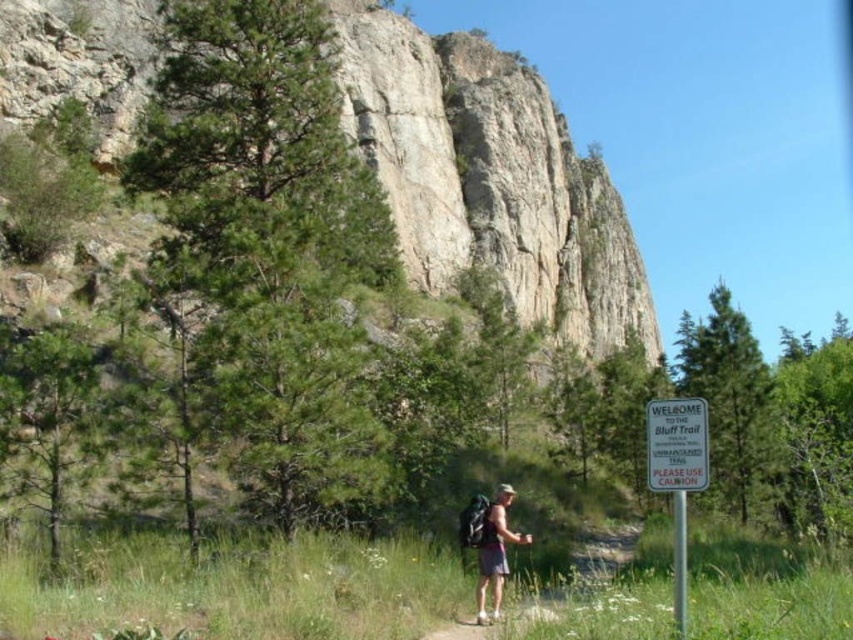
You are a hiker who wants to take a photo of the white plastic sign at center and the matte gray backpack at center. Which object should you zoom in on to capture both in the frame without moving your camera?

The white plastic sign at center occupies less space than the matte gray backpack at center, so you should zoom in on the matte gray backpack at center to include both objects in the frame without moving the camera.

You are a hiker who wants to take a photo of the rugged stone mountain at center and the matte gray backpack at center. Which object should you focus on first to ensure both are in the frame?

The rugged stone mountain at center is located above the matte gray backpack at center, so you should focus on the rugged stone mountain at center first to ensure both are in the frame.

You are a hiker standing at the point marked by the coordinates (x=490, y=179) on the map. Looking around, you see a rugged stone mountain at center. Which direction should you head to reach the signpost that says WELCOME TO THE Bluff Trail?

The point marked by the coordinates (x=490, y=179) is at the rugged stone mountain at center. Since the signpost is in the foreground near the hiker, you should head towards the foreground direction to reach it.